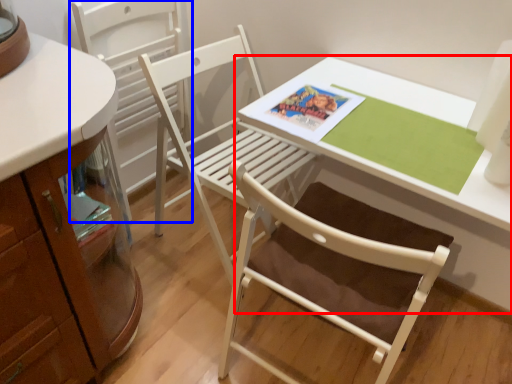
Question: Which point is further to the camera, table (highlighted by a red box) or chair (highlighted by a blue box)?

Choices:
 (A) table
 (B) chair

Answer: (B)